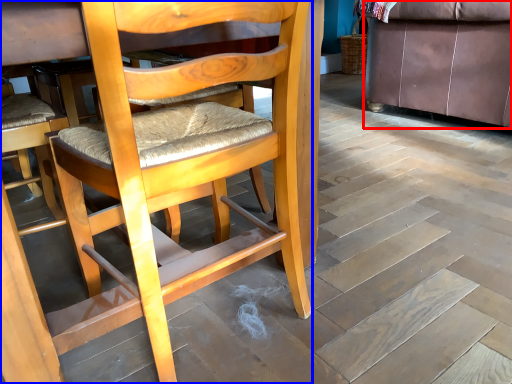
Question: Which object appears closest to the camera in this image, studio couch (highlighted by a red box) or chair (highlighted by a blue box)?

Choices:
 (A) studio couch
 (B) chair

Answer: (B)